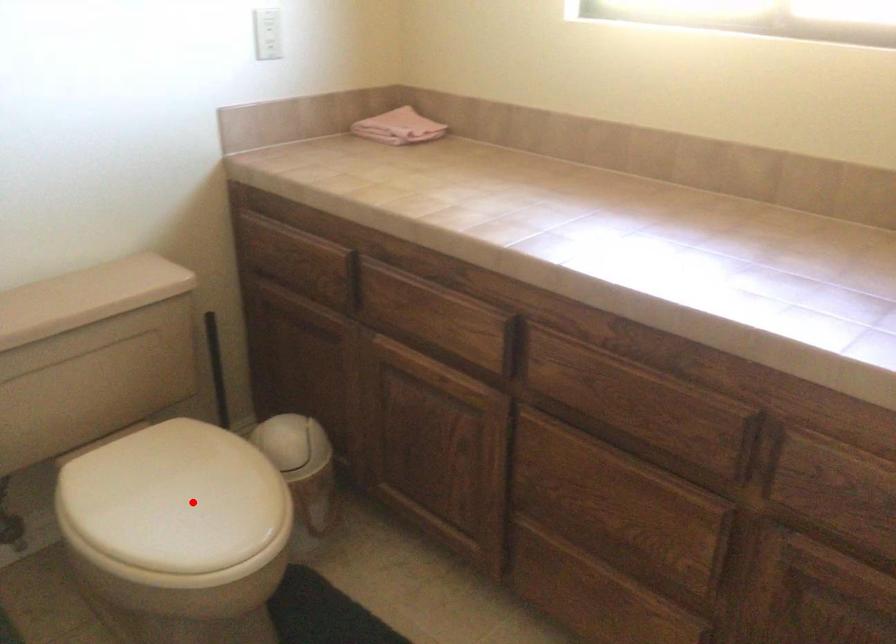
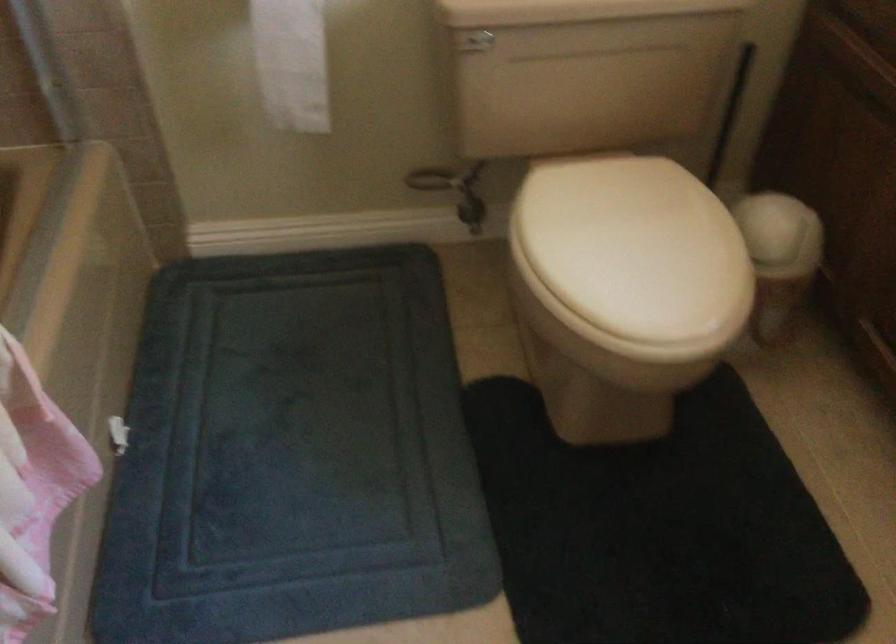
Question: A red point is marked in image1. In image2, is the corresponding 3D point closer to the camera or farther? Reply with the corresponding letter.

Choices:
 (A) The corresponding 3D point is closer.
 (B) The corresponding 3D point is farther.

Answer: (A)